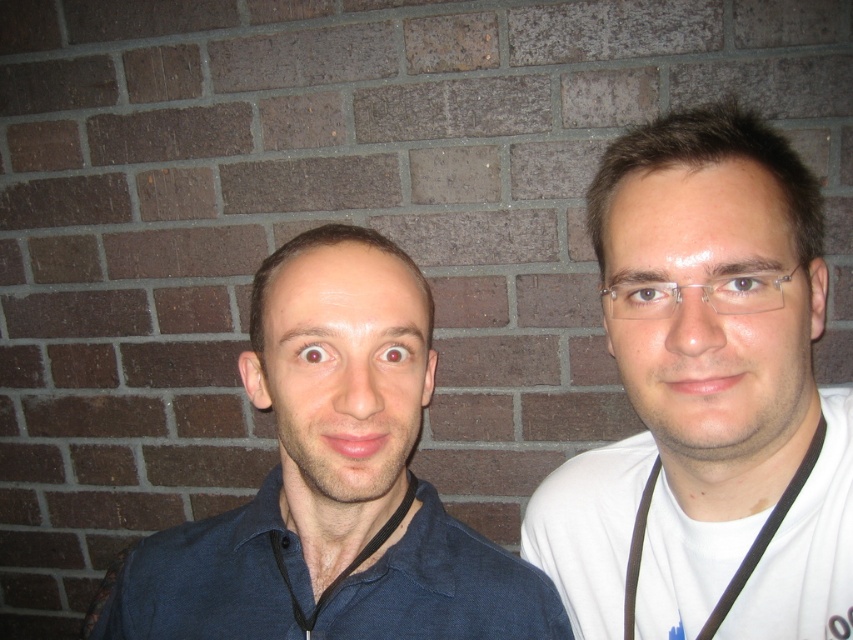
Is white matte shirt at right taller than matte blue shirt at center?

Yes.

Which of these two, white matte shirt at right or matte blue shirt at center, stands shorter?

matte blue shirt at center is shorter.

What do you see at coordinates (706, 401) in the screenshot?
I see `white matte shirt at right` at bounding box center [706, 401].

The image size is (853, 640). Find the location of `white matte shirt at right`. white matte shirt at right is located at coordinates (706, 401).

Can you confirm if matte blue shirt at center is positioned to the left of dark blue cotton polo shirt at left?

In fact, matte blue shirt at center is to the right of dark blue cotton polo shirt at left.

Can you confirm if matte blue shirt at center is positioned below dark blue cotton polo shirt at left?

Actually, matte blue shirt at center is above dark blue cotton polo shirt at left.

The height and width of the screenshot is (640, 853). What do you see at coordinates (332, 483) in the screenshot?
I see `matte blue shirt at center` at bounding box center [332, 483].

You are a GUI agent. You are given a task and a screenshot of the screen. Output one action in this format:
    pyautogui.click(x=<x>, y=<y>)
    Task: Click on the matte blue shirt at center
    The image size is (853, 640).
    Given the screenshot: What is the action you would take?
    pyautogui.click(x=332, y=483)

Is point (572, 624) positioned in front of point (409, 611)?

No.

Can you confirm if white matte shirt at right is bigger than dark blue cotton polo shirt at left?

No.

This screenshot has width=853, height=640. I want to click on white matte shirt at right, so click(x=706, y=401).